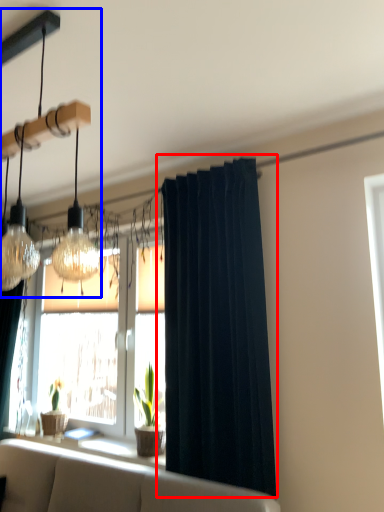
Question: Among these objects, which one is nearest to the camera, curtain (highlighted by a red box) or lamp (highlighted by a blue box)?

Choices:
 (A) curtain
 (B) lamp

Answer: (B)